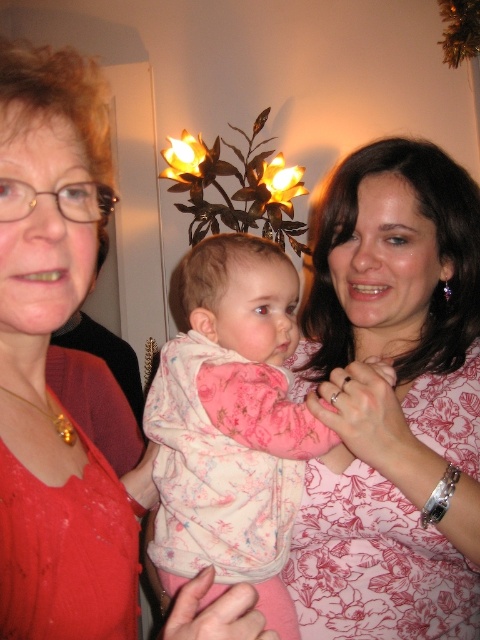
Question: Is floral pink blouse at center to the left of pink floral dress at center from the viewer's perspective?

Choices:
 (A) no
 (B) yes

Answer: (A)

Question: Which object is closer to the camera taking this photo?

Choices:
 (A) floral pink blouse at center
 (B) pink floral dress at center

Answer: (B)

Question: Can you confirm if floral pink blouse at center is thinner than pink floral dress at center?

Choices:
 (A) no
 (B) yes

Answer: (A)

Question: Which object is closer to the camera taking this photo?

Choices:
 (A) pink floral dress at center
 (B) fluffy pink pajamas at center
 (C) floral pink blouse at center

Answer: (A)

Question: Is floral pink blouse at center to the left of fluffy pink pajamas at center from the viewer's perspective?

Choices:
 (A) no
 (B) yes

Answer: (A)

Question: Which object is positioned closest to the pink floral dress at center?

Choices:
 (A) floral pink blouse at center
 (B) fluffy pink pajamas at center

Answer: (B)